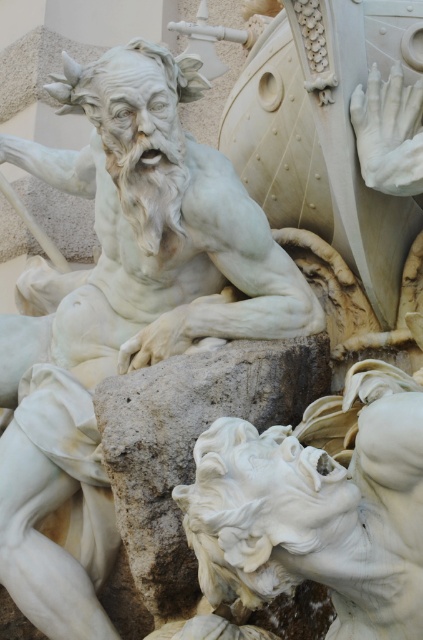
Question: Is white marble statue at center to the right of white marble stone at center from the viewer's perspective?

Choices:
 (A) no
 (B) yes

Answer: (A)

Question: From the image, what is the correct spatial relationship of white marble statue at center in relation to white marble stone at center?

Choices:
 (A) below
 (B) above

Answer: (B)

Question: Does white marble statue at center have a greater width compared to white marble stone at center?

Choices:
 (A) no
 (B) yes

Answer: (B)

Question: Among these points, which one is farthest from the camera?

Choices:
 (A) (310, 624)
 (B) (46, 365)

Answer: (B)

Question: Which object is closer to the camera taking this photo?

Choices:
 (A) white marble statue at center
 (B) white marble stone at center

Answer: (B)